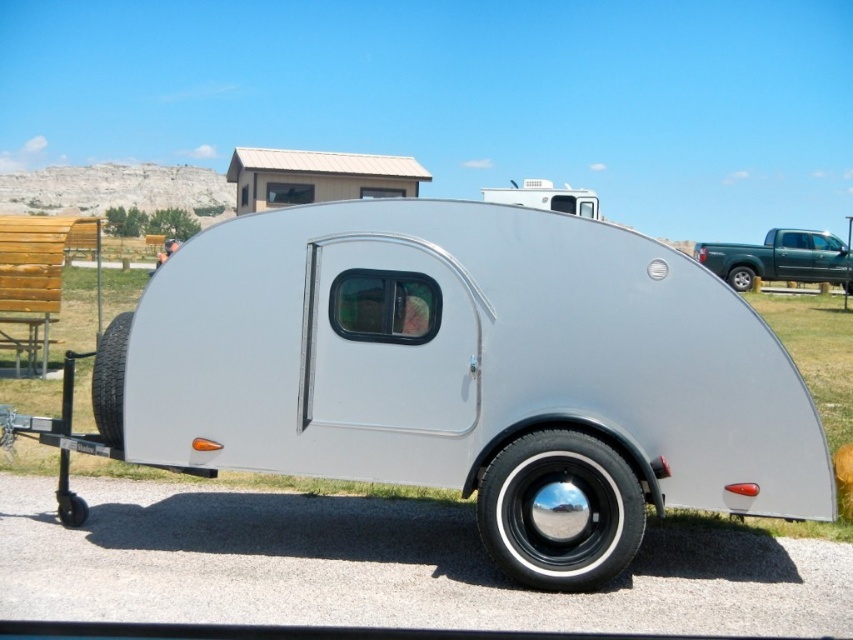
Question: Estimate the real-world distances between objects in this image. Which object is farther from the black rubber wheel at lower left?

Choices:
 (A) green matte truck at right
 (B) silver metallic teardrop trailer at center

Answer: (A)

Question: Where is black rubber tire at lower left located in relation to black rubber wheel at lower left in the image?

Choices:
 (A) below
 (B) above

Answer: (B)

Question: Which of the following is the farthest from the observer?

Choices:
 (A) silver metallic wheel at lower right
 (B) black rubber wheel at lower left

Answer: (A)

Question: Considering the real-world distances, which object is farthest from the silver metallic wheel at lower right?

Choices:
 (A) black rubber wheel at lower left
 (B) silver metallic teardrop trailer at center

Answer: (A)

Question: Is silver metallic teardrop trailer at center in front of green matte truck at right?

Choices:
 (A) no
 (B) yes

Answer: (B)

Question: Is shiny chrome wheel at lower center smaller than green matte truck at right?

Choices:
 (A) yes
 (B) no

Answer: (A)